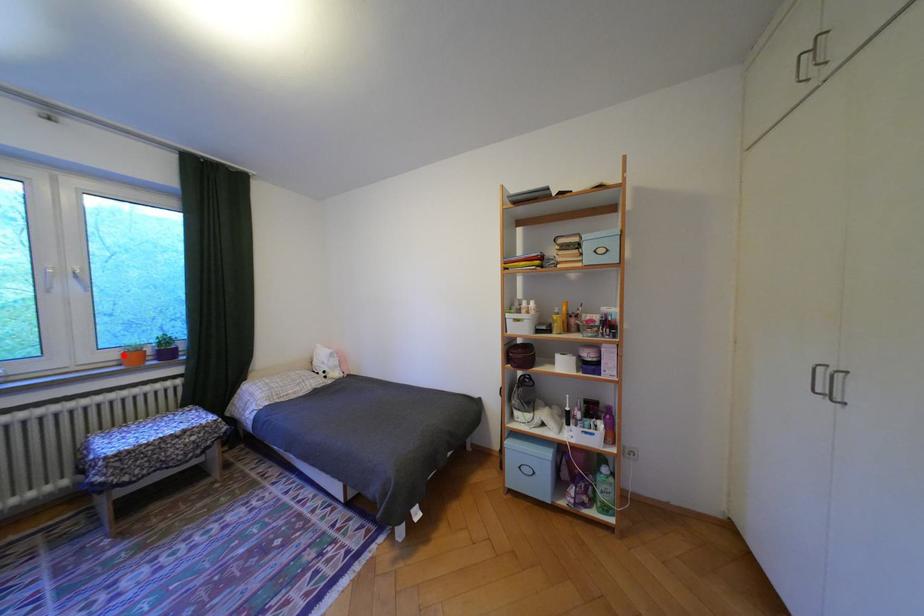
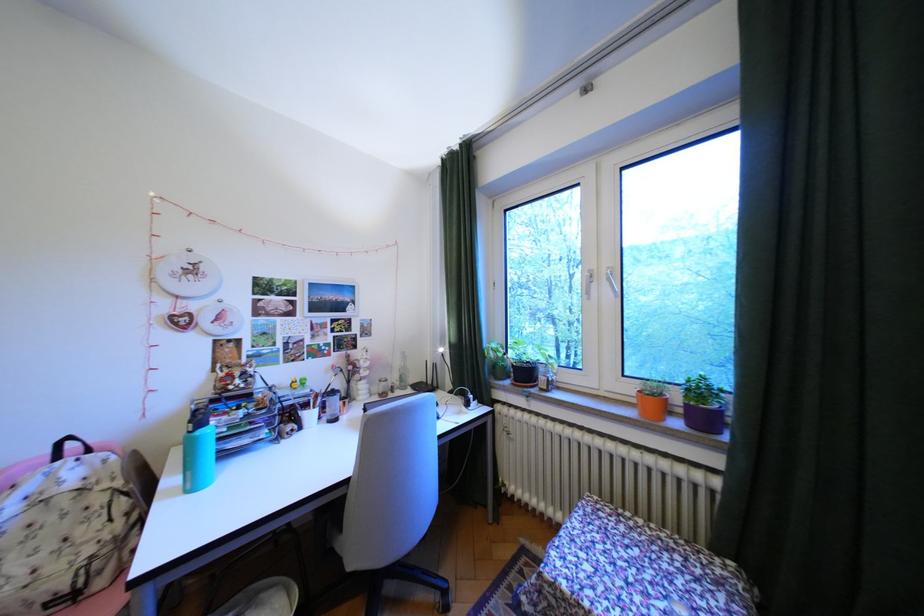
Where in the second image is the point corresponding to the highlighted location from the first image?

(641, 390)